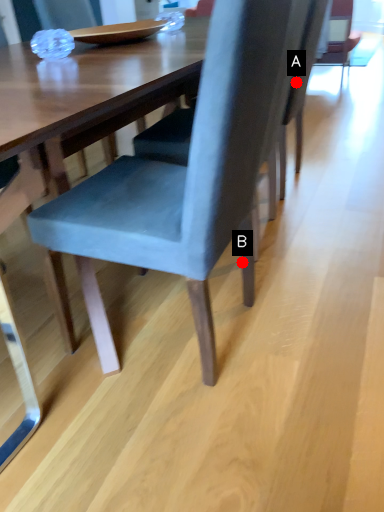
Question: Two points are circled on the image, labeled by A and B beside each circle. Which point is closer to the camera?

Choices:
 (A) A is closer
 (B) B is closer

Answer: (B)